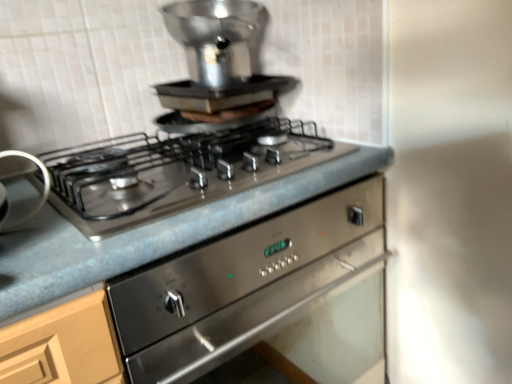
Question: Considering the relative positions of stainless steel gas stove at center and satin silver burner at left, the 1th appliance from the front, in the image provided, is stainless steel gas stove at center behind satin silver burner at left, the 1th appliance from the front,?

Choices:
 (A) no
 (B) yes

Answer: (A)

Question: Is stainless steel gas stove at center not within satin silver burner at left, placed as the 1th appliance when sorted from left to right?

Choices:
 (A) no
 (B) yes

Answer: (B)

Question: Is satin silver burner at left, the first appliance positioned from the bottom, surrounded by stainless steel gas stove at center?

Choices:
 (A) no
 (B) yes

Answer: (A)

Question: Does stainless steel gas stove at center turn towards satin silver burner at left, which is counted as the second appliance, starting from the top?

Choices:
 (A) yes
 (B) no

Answer: (B)

Question: From the image's perspective, is stainless steel gas stove at center over satin silver burner at left, which is the 2th appliance in back-to-front order?

Choices:
 (A) no
 (B) yes

Answer: (B)

Question: Is metallic gray countertop at center taller or shorter than satin silver pot at upper center, which is counted as the 2th appliance, starting from the left?

Choices:
 (A) short
 (B) tall

Answer: (B)

Question: Considering the positions of metallic gray countertop at center and satin silver pot at upper center, positioned as the 1th appliance in top-to-bottom order, in the image, is metallic gray countertop at center wider or thinner than satin silver pot at upper center, positioned as the 1th appliance in top-to-bottom order,?

Choices:
 (A) thin
 (B) wide

Answer: (B)

Question: Considering the positions of point (22, 264) and point (233, 31), is point (22, 264) closer or farther from the camera than point (233, 31)?

Choices:
 (A) closer
 (B) farther

Answer: (A)

Question: Is metallic gray countertop at center in front of or behind satin silver pot at upper center, which is the first appliance in back-to-front order, in the image?

Choices:
 (A) front
 (B) behind

Answer: (A)

Question: Considering the positions of stainless steel gas stove at center and metallic gray countertop at center in the image, is stainless steel gas stove at center wider or thinner than metallic gray countertop at center?

Choices:
 (A) thin
 (B) wide

Answer: (A)

Question: From their relative heights in the image, would you say stainless steel gas stove at center is taller or shorter than metallic gray countertop at center?

Choices:
 (A) tall
 (B) short

Answer: (B)

Question: Is stainless steel gas stove at center situated inside metallic gray countertop at center or outside?

Choices:
 (A) outside
 (B) inside

Answer: (A)

Question: From the image's perspective, is stainless steel gas stove at center positioned above or below metallic gray countertop at center?

Choices:
 (A) below
 (B) above

Answer: (B)

Question: Is satin silver pot at upper center, positioned as the 1th appliance in top-to-bottom order, bigger or smaller than metallic gray countertop at center?

Choices:
 (A) small
 (B) big

Answer: (A)

Question: Which is correct: satin silver pot at upper center, the second appliance positioned from the front, is inside metallic gray countertop at center, or outside of it?

Choices:
 (A) outside
 (B) inside

Answer: (A)